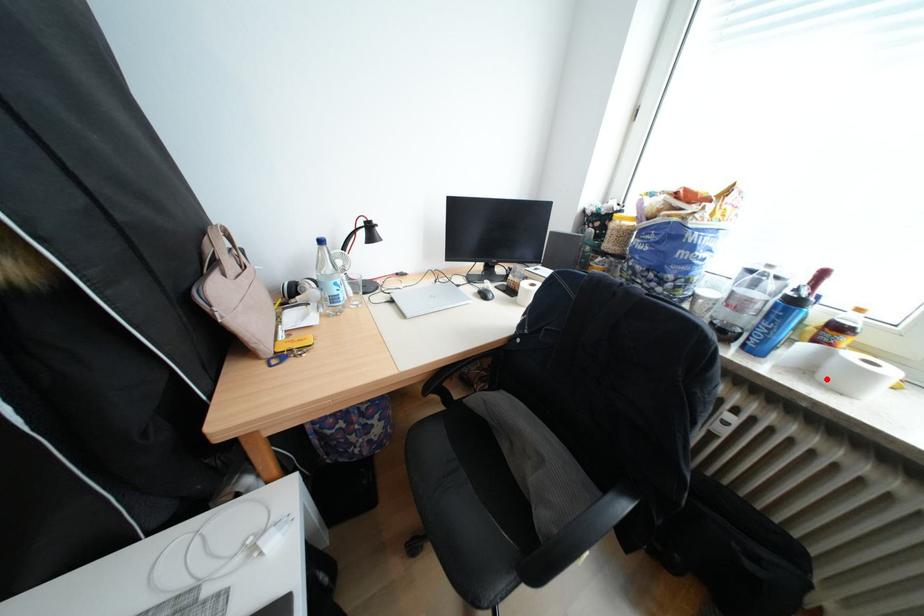
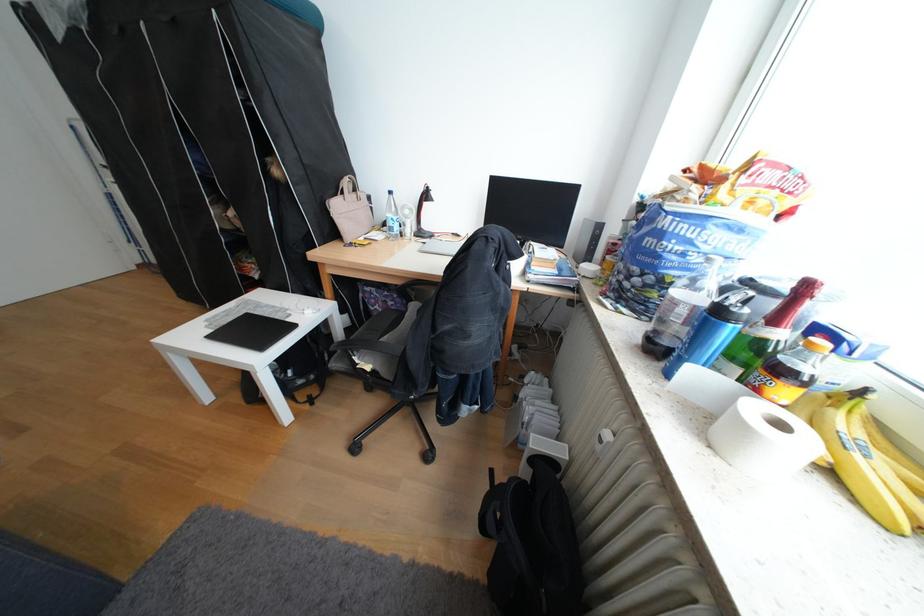
Locate, in the second image, the point that corresponds to the highlighted location in the first image.

(721, 424)